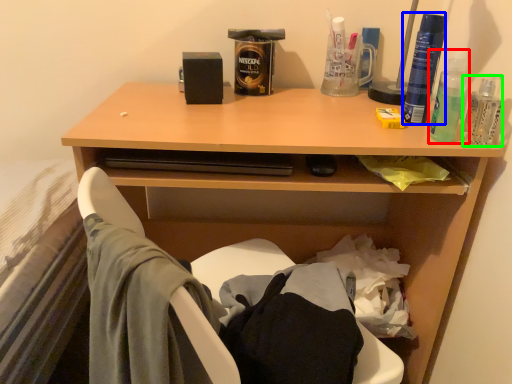
Question: Which is nearer to the mouthwash (highlighted by a red box)? bottle (highlighted by a blue box) or bottle (highlighted by a green box).

Choices:
 (A) bottle
 (B) bottle

Answer: (A)